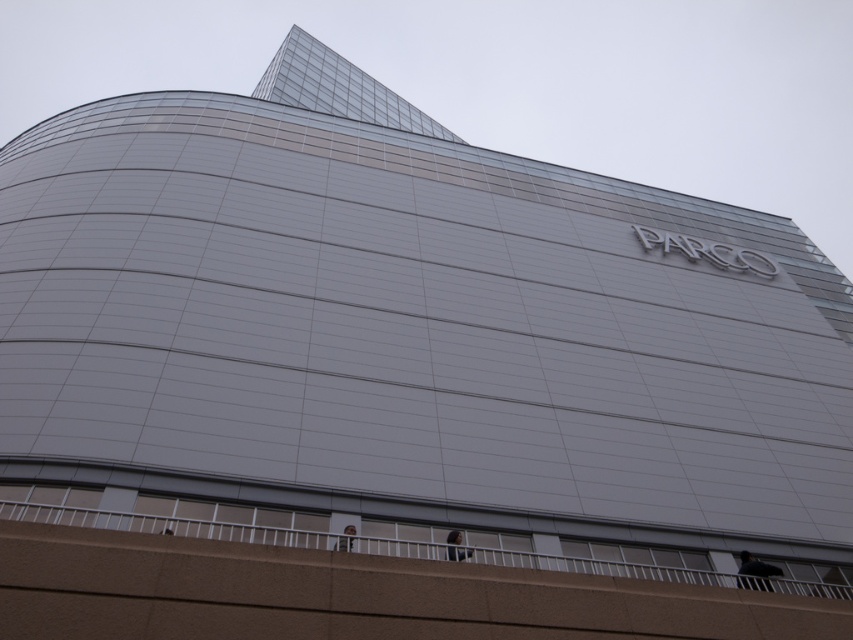
Question: Is light brown hair at lower center to the left of light brown fabric at lower center from the viewer's perspective?

Choices:
 (A) no
 (B) yes

Answer: (A)

Question: Which object appears farthest from the camera in this image?

Choices:
 (A) dark gray fabric at lower right
 (B) light brown hair at lower center
 (C) light brown fabric at lower center

Answer: (A)

Question: Can you confirm if dark gray fabric at lower right is positioned below light brown fabric at lower center?

Choices:
 (A) yes
 (B) no

Answer: (A)

Question: Which of the following is the closest to the observer?

Choices:
 (A) (750, 580)
 (B) (347, 531)
 (C) (456, 552)

Answer: (C)

Question: Which point appears closest to the camera in this image?

Choices:
 (A) (347, 547)
 (B) (764, 576)

Answer: (A)

Question: Is dark gray fabric at lower right thinner than light brown hair at lower center?

Choices:
 (A) yes
 (B) no

Answer: (B)